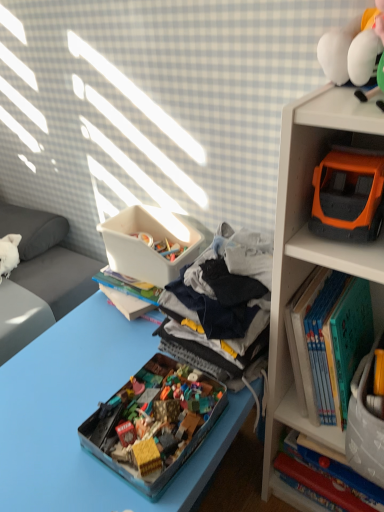
The width and height of the screenshot is (384, 512). What are the coordinates of `vacant point above blue plastic tray at center (from a real-world perspective)` in the screenshot? It's located at (80, 382).